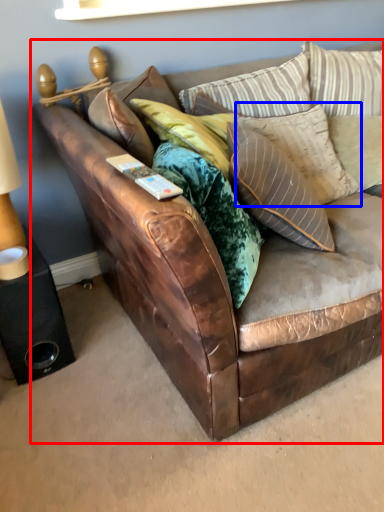
Question: Which object is closer to the camera taking this photo, studio couch (highlighted by a red box) or pillow (highlighted by a blue box)?

Choices:
 (A) studio couch
 (B) pillow

Answer: (A)